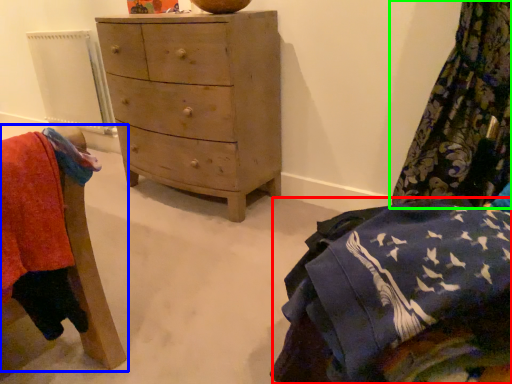
Question: Which is nearer to the clothing (highlighted by a red box)? furniture (highlighted by a blue box) or curtain (highlighted by a green box).

Choices:
 (A) furniture
 (B) curtain

Answer: (A)